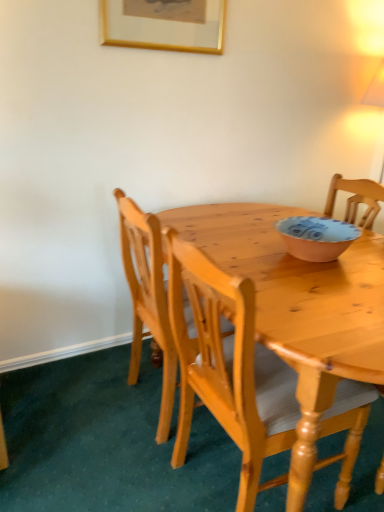
Find the location of a particular element. free point to the left of light brown wooden chair at center, the first chair positioned from the front is located at coordinates (119, 464).